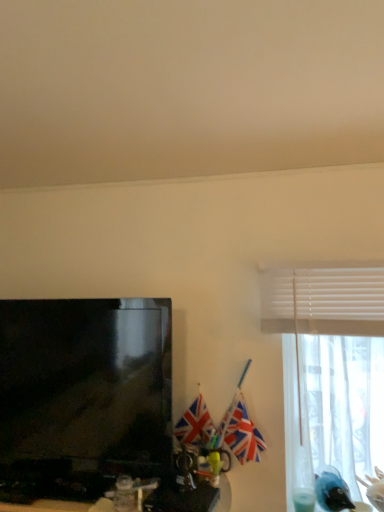
Question: Considering the relative sizes of sheer white curtain at right and matte black television at left in the image provided, is sheer white curtain at right taller than matte black television at left?

Choices:
 (A) no
 (B) yes

Answer: (B)

Question: Is sheer white curtain at right further to camera compared to matte black television at left?

Choices:
 (A) no
 (B) yes

Answer: (B)

Question: Is sheer white curtain at right not inside matte black television at left?

Choices:
 (A) yes
 (B) no

Answer: (A)

Question: Does sheer white curtain at right have a greater width compared to matte black television at left?

Choices:
 (A) yes
 (B) no

Answer: (A)

Question: Is sheer white curtain at right to the left of matte black television at left from the viewer's perspective?

Choices:
 (A) yes
 (B) no

Answer: (B)

Question: Can you confirm if sheer white curtain at right is positioned to the right of matte black television at left?

Choices:
 (A) no
 (B) yes

Answer: (B)

Question: Does shiny plastic computer desk at lower left have a smaller size compared to polyester flag at center, the first flag when ordered from left to right?

Choices:
 (A) no
 (B) yes

Answer: (A)

Question: Is shiny plastic computer desk at lower left with polyester flag at center, marked as the second flag in a right-to-left arrangement?

Choices:
 (A) no
 (B) yes

Answer: (A)

Question: Is the position of shiny plastic computer desk at lower left less distant than that of polyester flag at center, marked as the second flag in a right-to-left arrangement?

Choices:
 (A) yes
 (B) no

Answer: (A)

Question: Is shiny plastic computer desk at lower left shorter than polyester flag at center, the first flag when ordered from left to right?

Choices:
 (A) yes
 (B) no

Answer: (A)

Question: Is polyester flag at center, the first flag when ordered from left to right, located within shiny plastic computer desk at lower left?

Choices:
 (A) no
 (B) yes

Answer: (A)

Question: Can you confirm if shiny plastic computer desk at lower left is positioned to the right of polyester flag at center, the first flag when ordered from left to right?

Choices:
 (A) yes
 (B) no

Answer: (B)

Question: Is there a large distance between polyester flag at center, marked as the second flag in a right-to-left arrangement, and matte black television at left?

Choices:
 (A) yes
 (B) no

Answer: (B)